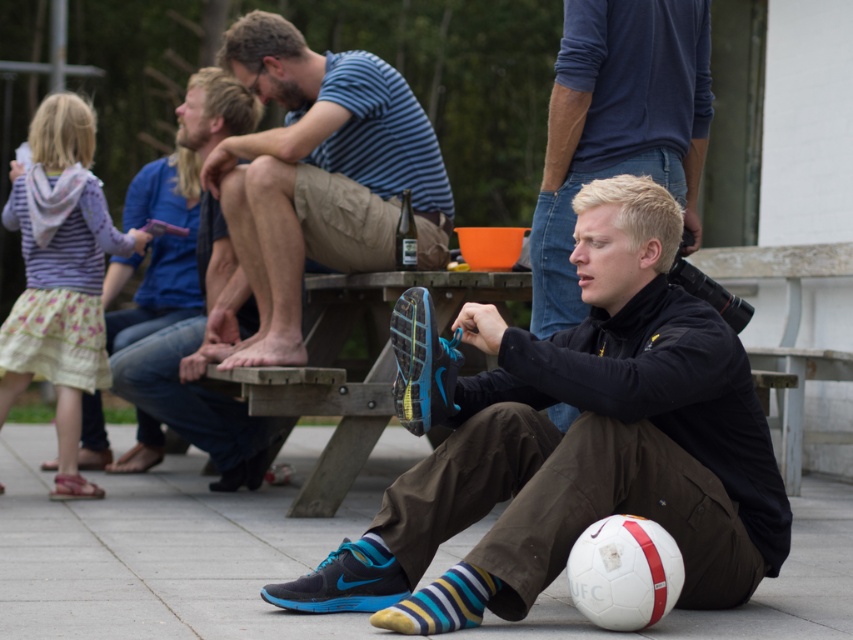
Question: Is striped cotton shirt at upper center wider than black matte jacket at center?

Choices:
 (A) yes
 (B) no

Answer: (A)

Question: Estimate the real-world distances between objects in this image. Which object is closer to the matte black jacket at center?

Choices:
 (A) black matte jacket at center
 (B) striped cotton shirt at upper center

Answer: (A)

Question: Which of these objects is positioned closest to the striped cotton shirt at upper center?

Choices:
 (A) black matte jacket at center
 (B) matte black jacket at center

Answer: (A)

Question: Which object is positioned closest to the black matte jacket at center?

Choices:
 (A) matte black jacket at center
 (B) striped cotton shirt at upper center

Answer: (A)

Question: Is striped cotton shirt at upper center wider than black matte jacket at center?

Choices:
 (A) no
 (B) yes

Answer: (B)

Question: Does matte black jacket at center appear over black matte jacket at center?

Choices:
 (A) no
 (B) yes

Answer: (A)